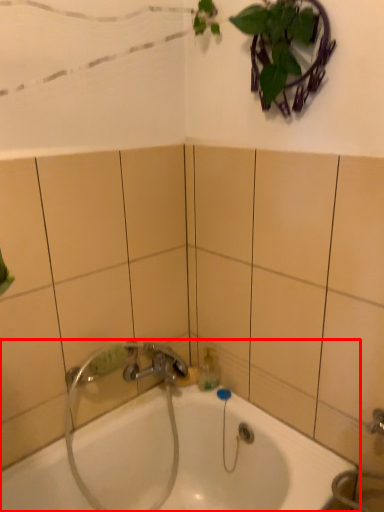
Question: From the image's perspective, considering the relative positions of bathtub (annotated by the red box) and plumbing fixture in the image provided, where is bathtub (annotated by the red box) located with respect to the staircase?

Choices:
 (A) above
 (B) below

Answer: (B)